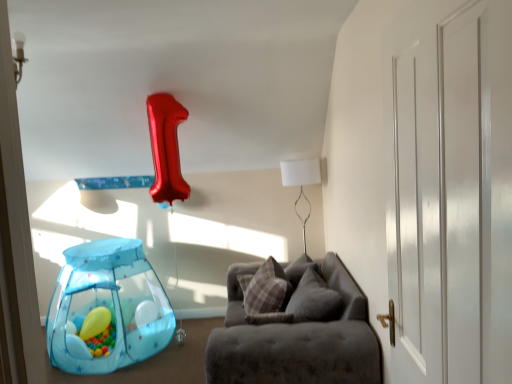
This screenshot has height=384, width=512. What do you see at coordinates (297, 340) in the screenshot?
I see `velvet grey couch at center` at bounding box center [297, 340].

What do you see at coordinates (106, 309) in the screenshot?
I see `translucent blue mesh tent at lower left, the second balloon viewed from the left` at bounding box center [106, 309].

Find the location of a particular element. Image resolution: width=512 pixels, height=384 pixels. matte yellow balloon at lower left, which appears as the first balloon when viewed from the left is located at coordinates (95, 322).

Measure the distance between white matte table lamp at upper center and camera.

white matte table lamp at upper center and camera are 3.69 meters apart from each other.

This screenshot has width=512, height=384. Identify the location of velvet grey couch at center. (297, 340).

From the image's perspective, which is below, white matte table lamp at upper center or translucent blue mesh tent at lower left, the second balloon viewed from the left?

From the image's view, translucent blue mesh tent at lower left, the second balloon viewed from the left, is below.

Is white matte table lamp at upper center not inside translucent blue mesh tent at lower left, the second balloon viewed from the left?

Indeed, white matte table lamp at upper center is completely outside translucent blue mesh tent at lower left, the second balloon viewed from the left.

Looking at this image, is white matte table lamp at upper center directly adjacent to translucent blue mesh tent at lower left, the first balloon in the right-to-left sequence?

No, white matte table lamp at upper center is not making contact with translucent blue mesh tent at lower left, the first balloon in the right-to-left sequence.

Considering the sizes of white matte table lamp at upper center and translucent blue mesh tent at lower left, the second balloon viewed from the left, in the image, is white matte table lamp at upper center taller or shorter than translucent blue mesh tent at lower left, the second balloon viewed from the left,?

Clearly, white matte table lamp at upper center is taller compared to translucent blue mesh tent at lower left, the second balloon viewed from the left.

Considering the relative sizes of translucent blue mesh tent at lower left, the second balloon viewed from the left, and velvet grey couch at center in the image provided, is translucent blue mesh tent at lower left, the second balloon viewed from the left, taller than velvet grey couch at center?

Yes, translucent blue mesh tent at lower left, the second balloon viewed from the left, is taller than velvet grey couch at center.

From the image's perspective, relative to velvet grey couch at center, is translucent blue mesh tent at lower left, the second balloon viewed from the left, above or below?

From the image's perspective, translucent blue mesh tent at lower left, the second balloon viewed from the left, appears above velvet grey couch at center.

Is translucent blue mesh tent at lower left, the second balloon viewed from the left, wider or thinner than velvet grey couch at center?

Clearly, translucent blue mesh tent at lower left, the second balloon viewed from the left, has less width compared to velvet grey couch at center.

Do you think white matte table lamp at upper center is within white glossy door at right, or outside of it?

white matte table lamp at upper center cannot be found inside white glossy door at right.

Is white matte table lamp at upper center touching white glossy door at right?

white matte table lamp at upper center and white glossy door at right are clearly separated.

Considering the positions of points (303, 232) and (412, 135), is point (303, 232) farther from camera compared to point (412, 135)?

Yes, it is.

Is white matte table lamp at upper center in front of white glossy door at right?

No, it is not.

Is translucent blue mesh tent at lower left, the first balloon in the right-to-left sequence, turned away from plaid fabric pillow at center?

No, translucent blue mesh tent at lower left, the first balloon in the right-to-left sequence, is not facing away from plaid fabric pillow at center.

Consider the image. Is translucent blue mesh tent at lower left, the first balloon in the right-to-left sequence, not inside plaid fabric pillow at center?

Yes, translucent blue mesh tent at lower left, the first balloon in the right-to-left sequence, is not within plaid fabric pillow at center.

From a real-world perspective, is translucent blue mesh tent at lower left, the first balloon in the right-to-left sequence, positioned over plaid fabric pillow at center based on gravity?

No, from a real-world perspective, translucent blue mesh tent at lower left, the first balloon in the right-to-left sequence, is not above plaid fabric pillow at center.

Consider the image. Considering the sizes of objects translucent blue mesh tent at lower left, the first balloon in the right-to-left sequence, and plaid fabric pillow at center in the image provided, who is wider, translucent blue mesh tent at lower left, the first balloon in the right-to-left sequence, or plaid fabric pillow at center?

translucent blue mesh tent at lower left, the first balloon in the right-to-left sequence.

Consider the image. Which point is more distant from viewer, (92, 335) or (258, 311)?

The point (92, 335) is farther from the camera.

Is matte yellow balloon at lower left, which ranks as the second balloon in right-to-left order, in front of or behind plaid fabric pillow at center in the image?

matte yellow balloon at lower left, which ranks as the second balloon in right-to-left order, is behind plaid fabric pillow at center.

Is the surface of matte yellow balloon at lower left, which appears as the first balloon when viewed from the left, in direct contact with plaid fabric pillow at center?

No, matte yellow balloon at lower left, which appears as the first balloon when viewed from the left, is not touching plaid fabric pillow at center.

Which is more to the right, matte yellow balloon at lower left, which appears as the first balloon when viewed from the left, or plaid fabric pillow at center?

plaid fabric pillow at center is more to the right.

From a real-world perspective, which is physically below, translucent blue mesh tent at lower left, the first balloon in the right-to-left sequence, or white glossy door at right?

translucent blue mesh tent at lower left, the first balloon in the right-to-left sequence, is physically lower.

Which object is further away from the camera, translucent blue mesh tent at lower left, the first balloon in the right-to-left sequence, or white glossy door at right?

translucent blue mesh tent at lower left, the first balloon in the right-to-left sequence, is further from the camera.

Is translucent blue mesh tent at lower left, the second balloon viewed from the left, in contact with white glossy door at right?

translucent blue mesh tent at lower left, the second balloon viewed from the left, and white glossy door at right are not in contact.

Considering the relative sizes of translucent blue mesh tent at lower left, the second balloon viewed from the left, and white glossy door at right in the image provided, is translucent blue mesh tent at lower left, the second balloon viewed from the left, smaller than white glossy door at right?

Incorrect, translucent blue mesh tent at lower left, the second balloon viewed from the left, is not smaller in size than white glossy door at right.

Based on the photo, from a real-world perspective, between white matte table lamp at upper center and plaid fabric pillow at center, who is vertically higher?

white matte table lamp at upper center, from a real-world perspective.

Considering the relative sizes of white matte table lamp at upper center and plaid fabric pillow at center in the image provided, is white matte table lamp at upper center wider than plaid fabric pillow at center?

Indeed, white matte table lamp at upper center has a greater width compared to plaid fabric pillow at center.

Is white matte table lamp at upper center aimed at plaid fabric pillow at center?

No.

Considering the sizes of objects white matte table lamp at upper center and plaid fabric pillow at center in the image provided, who is bigger, white matte table lamp at upper center or plaid fabric pillow at center?

With larger size is white matte table lamp at upper center.

There is a white matte table lamp at upper center. What are the coordinates of `the 1st balloon below it (from a real-world perspective)` in the screenshot? It's located at (106, 309).

The image size is (512, 384). Find the location of `the 1st balloon to the left of the velvet grey couch at center, starting your count from the anchor`. the 1st balloon to the left of the velvet grey couch at center, starting your count from the anchor is located at coordinates (106, 309).

Estimate the real-world distances between objects in this image. Which object is further from matte yellow balloon at lower left, which ranks as the second balloon in right-to-left order, velvet grey couch at center or white glossy door at right?

Among the two, white glossy door at right is located further to matte yellow balloon at lower left, which ranks as the second balloon in right-to-left order.

Which object lies further to the anchor point translucent blue mesh tent at lower left, the second balloon viewed from the left, white glossy door at right or white matte table lamp at upper center?

Among the two, white glossy door at right is located further to translucent blue mesh tent at lower left, the second balloon viewed from the left.

Looking at the image, which one is located further to translucent blue mesh tent at lower left, the second balloon viewed from the left, velvet grey couch at center or white glossy door at right?

The object further to translucent blue mesh tent at lower left, the second balloon viewed from the left, is white glossy door at right.

Considering their positions, is plaid fabric pillow at center positioned further to matte yellow balloon at lower left, which ranks as the second balloon in right-to-left order, than white matte table lamp at upper center?

The object further to matte yellow balloon at lower left, which ranks as the second balloon in right-to-left order, is white matte table lamp at upper center.

Considering their positions, is white glossy door at right positioned further to white matte table lamp at upper center than translucent blue mesh tent at lower left, the first balloon in the right-to-left sequence?

white glossy door at right.

When comparing their distances from white matte table lamp at upper center, does plaid fabric pillow at center or matte yellow balloon at lower left, which ranks as the second balloon in right-to-left order, seem further?

matte yellow balloon at lower left, which ranks as the second balloon in right-to-left order, is positioned further to the anchor white matte table lamp at upper center.

Based on their spatial positions, is matte yellow balloon at lower left, which appears as the first balloon when viewed from the left, or velvet grey couch at center closer to white matte table lamp at upper center?

The object closer to white matte table lamp at upper center is velvet grey couch at center.

Which object lies nearer to the anchor point plaid fabric pillow at center, matte yellow balloon at lower left, which ranks as the second balloon in right-to-left order, or white glossy door at right?

matte yellow balloon at lower left, which ranks as the second balloon in right-to-left order.

The height and width of the screenshot is (384, 512). I want to click on pillow between velvet grey couch at center and white matte table lamp at upper center from front to back, so click(266, 291).

Locate an element on the screen. The height and width of the screenshot is (384, 512). balloon between white glossy door at right and matte yellow balloon at lower left, which ranks as the second balloon in right-to-left order, along the z-axis is located at coordinates (106, 309).

I want to click on balloon between white glossy door at right and white matte table lamp at upper center along the z-axis, so click(x=106, y=309).

Image resolution: width=512 pixels, height=384 pixels. Find the location of `studio couch between white glossy door at right and plaid fabric pillow at center in the front-back direction`. studio couch between white glossy door at right and plaid fabric pillow at center in the front-back direction is located at coordinates (297, 340).